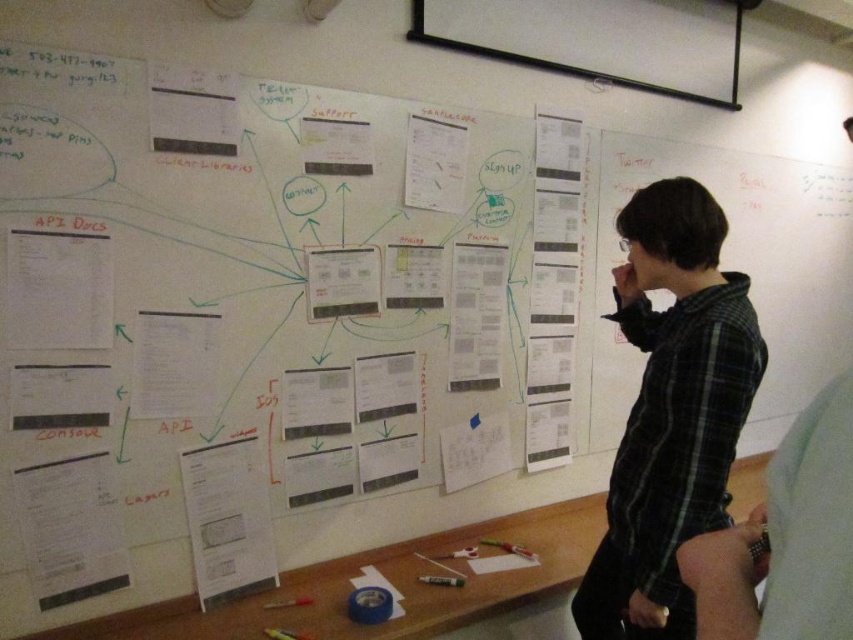
Does black plaid shirt at center have a greater height compared to white matte projector screen at upper center?

Yes.

Can you confirm if black plaid shirt at center is smaller than white matte projector screen at upper center?

Yes, black plaid shirt at center is smaller than white matte projector screen at upper center.

The height and width of the screenshot is (640, 853). I want to click on black plaid shirt at center, so 671,412.

Does point (601, 621) come behind point (599, 365)?

That is False.

Which is in front, point (664, 339) or point (821, 228)?

Point (664, 339) is more forward.

Does point (695, 497) lie in front of point (624, 195)?

Yes, point (695, 497) is closer to viewer.

Locate an element on the screen. The image size is (853, 640). black plaid shirt at center is located at coordinates (671, 412).

Does point (779, 209) lie behind point (527, 58)?

Yes, point (779, 209) is farther from viewer.

Image resolution: width=853 pixels, height=640 pixels. Identify the location of white paper at upper right. (738, 269).

The height and width of the screenshot is (640, 853). Describe the element at coordinates (738, 269) in the screenshot. I see `white paper at upper right` at that location.

This screenshot has width=853, height=640. I want to click on white paper at upper right, so click(738, 269).